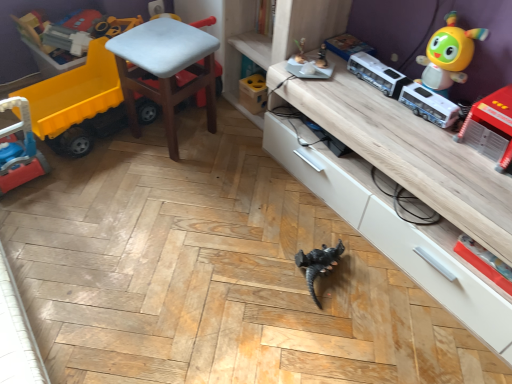
Question: Is white plastic chair at center inside the boundaries of shiny yellow toy at upper right, the second toy viewed from the right, or outside?

Choices:
 (A) outside
 (B) inside

Answer: (A)

Question: In the image, is white plastic chair at center positioned in front of or behind shiny yellow toy at upper right, the second toy viewed from the right?

Choices:
 (A) front
 (B) behind

Answer: (B)

Question: Estimate the real-world distances between objects in this image. Which object is closer to the rubber yellow truck at left, the first toy viewed from the left?

Choices:
 (A) wooden shelf at center
 (B) matte blue book at upper center, acting as the 3th toy starting from the right
 (C) red plastic fire truck at right, positioned as the first toy in right-to-left order
 (D) shiny yellow toy at upper right, the second toy viewed from the right
 (E) wooden block at center, placed as the 2th toy when sorted from left to right

Answer: (A)

Question: Which object is positioned farthest from the white plastic bus at upper right?

Choices:
 (A) shiny yellow toy at upper right, which appears as the fourth toy when viewed from the left
 (B) rubber yellow truck at left, the first toy viewed from the left
 (C) wooden cabinet at lower center
 (D) wooden shelf at center
 (E) red plastic fire truck at right, positioned as the fifth toy in left-to-right order

Answer: (B)